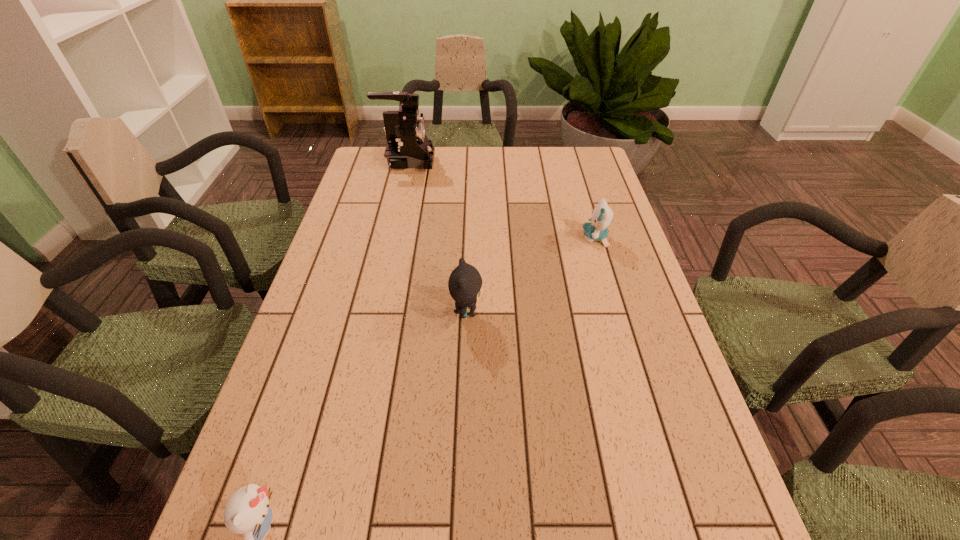
Locate which kitten ranks in proximity to the farthest kitten. Please provide its 2D coordinates. Your answer should be formatted as a tuple, i.e. [(x, y)], where the tuple contains the x and y coordinates of a point satisfying the conditions above.

[(465, 282)]